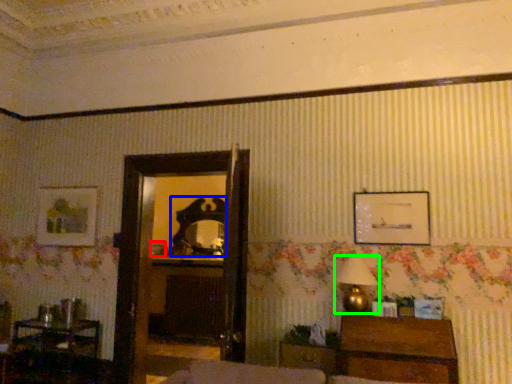
Question: Considering the real-world distances, which object is farthest from picture frame (highlighted by a red box)? mirror (highlighted by a blue box) or table lamp (highlighted by a green box)?

Choices:
 (A) mirror
 (B) table lamp

Answer: (B)